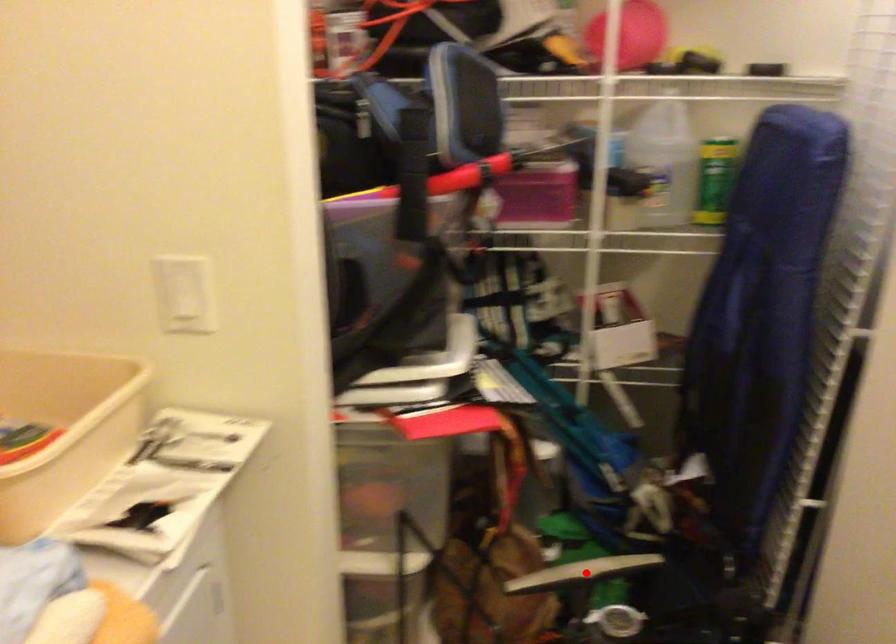
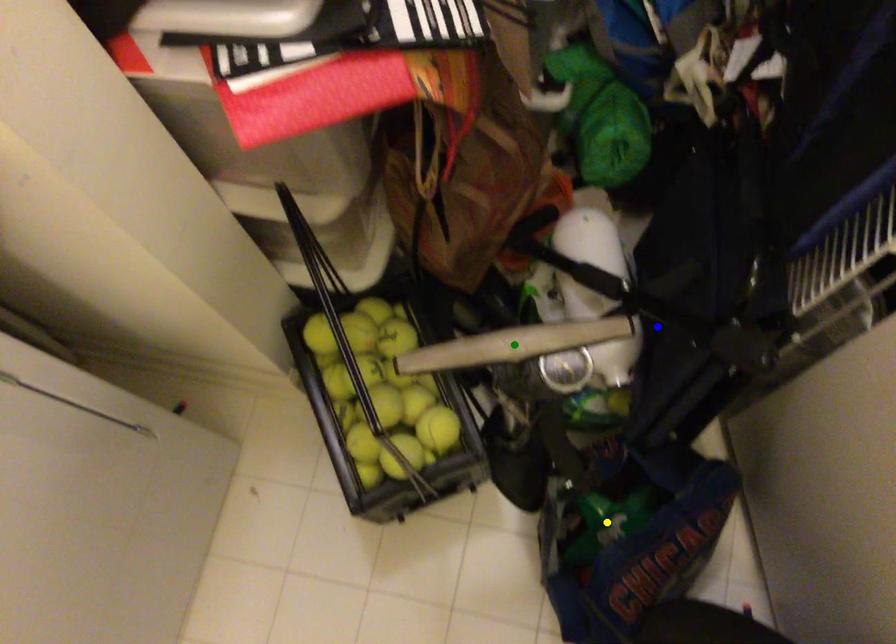
Question: I am providing you with two images of the same scene from different viewpoints. A red point is marked on the first image. You are given multiple points on the second image. Can you choose the point in image 2 that corresponds to the point in image 1?

Choices:
 (A) blue point
 (B) green point
 (C) yellow point

Answer: (B)